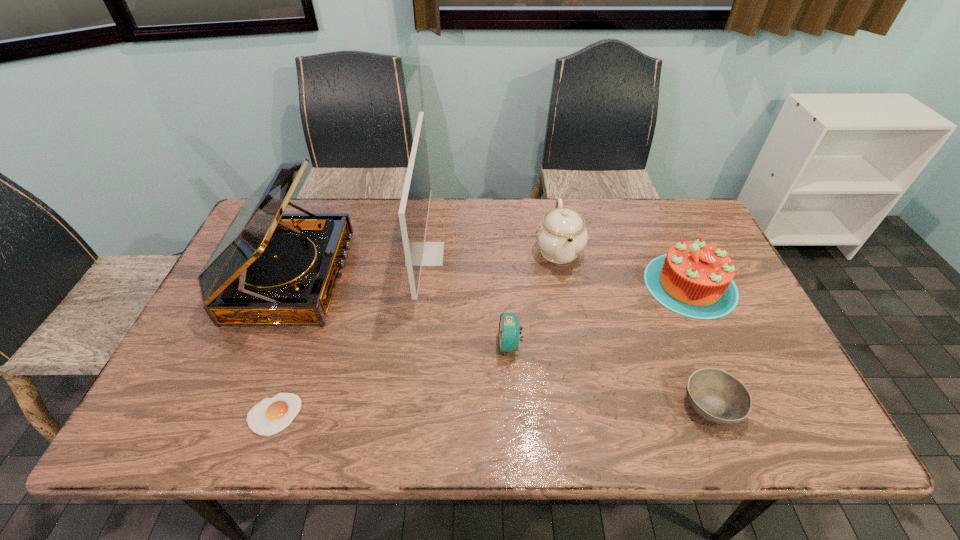
This screenshot has width=960, height=540. What are the coordinates of `bowl situated at the near edge` in the screenshot? It's located at (717, 396).

At what (x,y) coordinates should I click in order to perform the action: click on egg yolk situated at the near edge. Please return your answer as a coordinate pair (x, y). Looking at the image, I should click on (268, 417).

At what (x,y) coordinates should I click in order to perform the action: click on object that is at the left edge. Please return your answer as a coordinate pair (x, y). The image size is (960, 540). Looking at the image, I should click on (269, 269).

Locate an element on the screen. cake that is at the right edge is located at coordinates (695, 279).

Where is `bowl that is at the right edge`? bowl that is at the right edge is located at coordinates (717, 396).

Locate an element on the screen. Image resolution: width=960 pixels, height=540 pixels. object located at the far left corner is located at coordinates (x=269, y=269).

The height and width of the screenshot is (540, 960). Find the location of `object that is at the near right corner`. object that is at the near right corner is located at coordinates (717, 396).

Locate an element on the screen. The image size is (960, 540). free space at the far edge of the desktop is located at coordinates (343, 200).

Find the location of a particular element. This screenshot has height=540, width=960. free location at the near edge is located at coordinates (557, 408).

Identify the location of vacant space at the right edge. Image resolution: width=960 pixels, height=540 pixels. (746, 303).